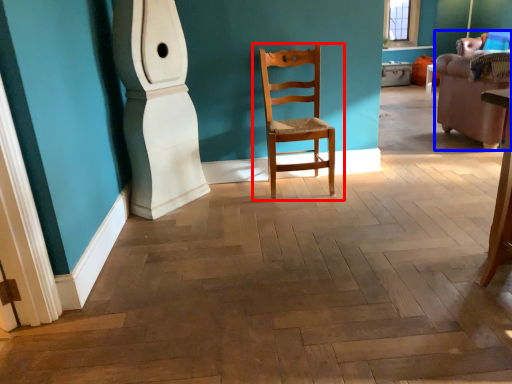
Question: Among these objects, which one is farthest to the camera, chair (highlighted by a red box) or armchair (highlighted by a blue box)?

Choices:
 (A) chair
 (B) armchair

Answer: (B)